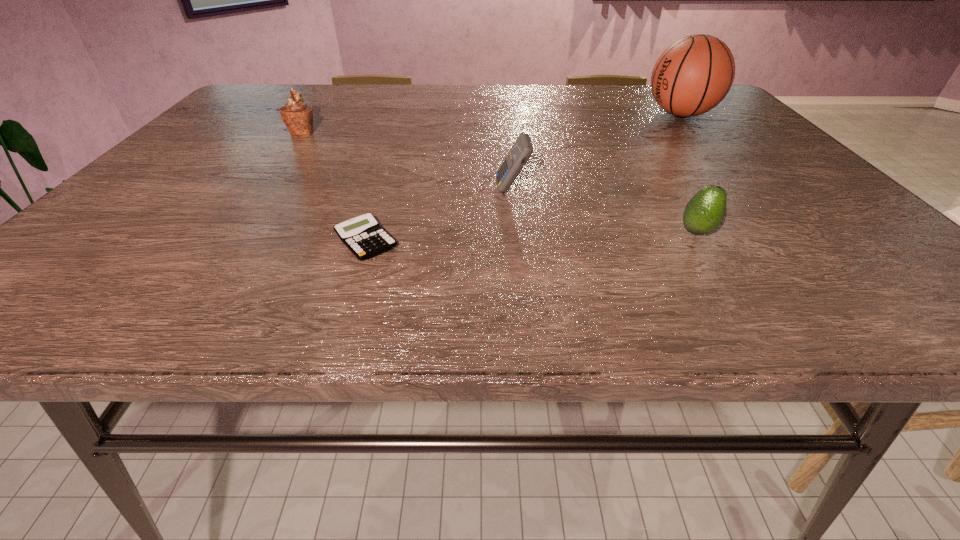
At what (x,y) coordinates should I click in order to perform the action: click on free space between the muffin and the shortest object. Please return your answer as a coordinate pair (x, y). This screenshot has height=540, width=960. Looking at the image, I should click on (334, 187).

The image size is (960, 540). I want to click on vacant area that lies between the third farthest object and the fourth object from left to right, so click(605, 211).

The width and height of the screenshot is (960, 540). In order to click on free space between the taller calculator and the rightmost object in this screenshot , I will do `click(596, 152)`.

Identify the location of empty location between the rightmost object and the shortest object. (523, 178).

At what (x,y) coordinates should I click in order to perform the action: click on vacant area that lies between the avocado and the third object from right to left. Please return your answer as a coordinate pair (x, y). The height and width of the screenshot is (540, 960). Looking at the image, I should click on (605, 211).

At what (x,y) coordinates should I click in order to perform the action: click on vacant region between the fourth tallest object and the left calculator. Please return your answer as a coordinate pair (x, y). Image resolution: width=960 pixels, height=540 pixels. Looking at the image, I should click on (532, 237).

Locate an element on the screen. vacant area that lies between the second object from right to left and the basketball is located at coordinates (688, 173).

This screenshot has width=960, height=540. I want to click on the third closest object to the left calculator, so click(705, 211).

This screenshot has height=540, width=960. What are the coordinates of `object that is the third closest to the fourth tallest object` in the screenshot? It's located at (363, 235).

Image resolution: width=960 pixels, height=540 pixels. What are the coordinates of `vacant region that satisfies the following two spatial constraints: 1. on the back side of the avocado; 2. on the front-facing side of the farther calculator` in the screenshot? It's located at (669, 190).